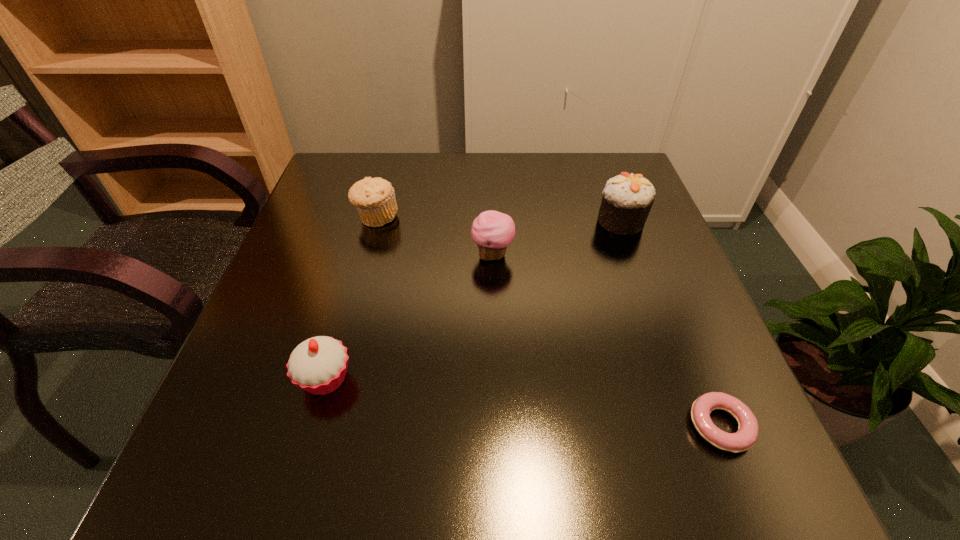
Select which object appears as the fourth closest to the second cupcake from right to left. Please provide its 2D coordinates. Your answer should be formatted as a tuple, i.e. [(x, y)], where the tuple contains the x and y coordinates of a point satisfying the conditions above.

[(746, 436)]

Locate an element on the screen. The width and height of the screenshot is (960, 540). object that is the nearest to the farthest cupcake is located at coordinates (492, 231).

You are a GUI agent. You are given a task and a screenshot of the screen. Output one action in this format:
    pyautogui.click(x=<x>, y=<y>)
    Task: Click on the cupcake identified as the second closest to the third farthest object
    
    Given the screenshot: What is the action you would take?
    pyautogui.click(x=318, y=365)

Identify which cupcake is the third closest to the muffin. Please provide its 2D coordinates. Your answer should be formatted as a tuple, i.e. [(x, y)], where the tuple contains the x and y coordinates of a point satisfying the conditions above.

[(627, 199)]

I want to click on vacant space that satisfies the following two spatial constraints: 1. on the front side of the muffin; 2. on the left side of the third farthest object, so click(366, 255).